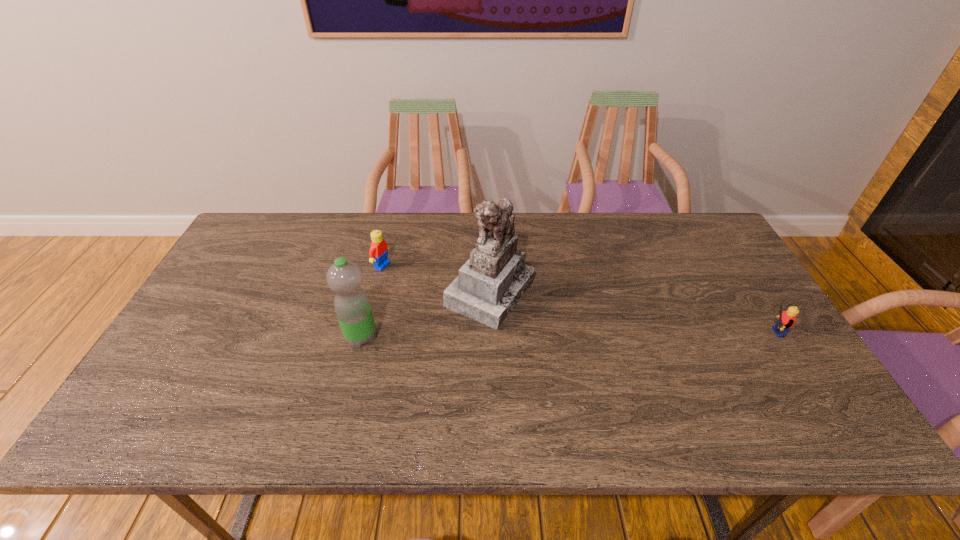
I want to click on vacant space that is in between the second tallest object and the farther Lego, so click(x=372, y=301).

Find the location of a particular element. free area in between the rightmost object and the third object from left to right is located at coordinates (629, 312).

I want to click on free area in between the nearer Lego and the farther Lego, so click(x=575, y=299).

Locate an element on the screen. The height and width of the screenshot is (540, 960). vacant area that lies between the figurine and the rightmost object is located at coordinates (629, 312).

Where is `vacant space that is in between the figurine and the water bottle`? vacant space that is in between the figurine and the water bottle is located at coordinates (425, 314).

Identify the location of object that stands as the closest to the nearer Lego. (489, 285).

Select which object appears as the second closest to the rightmost object. Please provide its 2D coordinates. Your answer should be formatted as a tuple, i.e. [(x, y)], where the tuple contains the x and y coordinates of a point satisfying the conditions above.

[(352, 306)]

Find the location of `free location that satisfies the following two spatial constraints: 1. on the back side of the second tallest object; 2. on the front-facing side of the right Lego`. free location that satisfies the following two spatial constraints: 1. on the back side of the second tallest object; 2. on the front-facing side of the right Lego is located at coordinates (363, 333).

This screenshot has width=960, height=540. Find the location of `vacant space that satisfies the following two spatial constraints: 1. on the front side of the figurine; 2. on the front-facing side of the rightmost object`. vacant space that satisfies the following two spatial constraints: 1. on the front side of the figurine; 2. on the front-facing side of the rightmost object is located at coordinates (491, 333).

Image resolution: width=960 pixels, height=540 pixels. Find the location of `vacant position in the image that satisfies the following two spatial constraints: 1. on the back side of the tallest object; 2. on the left side of the second tallest object`. vacant position in the image that satisfies the following two spatial constraints: 1. on the back side of the tallest object; 2. on the left side of the second tallest object is located at coordinates (372, 291).